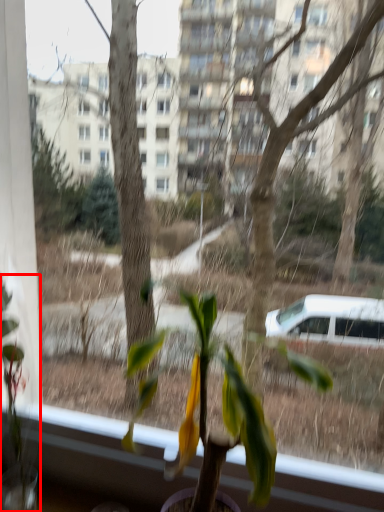
Question: From the image's perspective, what is the correct spatial relationship of houseplant (annotated by the red box) in relation to houseplant?

Choices:
 (A) above
 (B) below

Answer: (A)